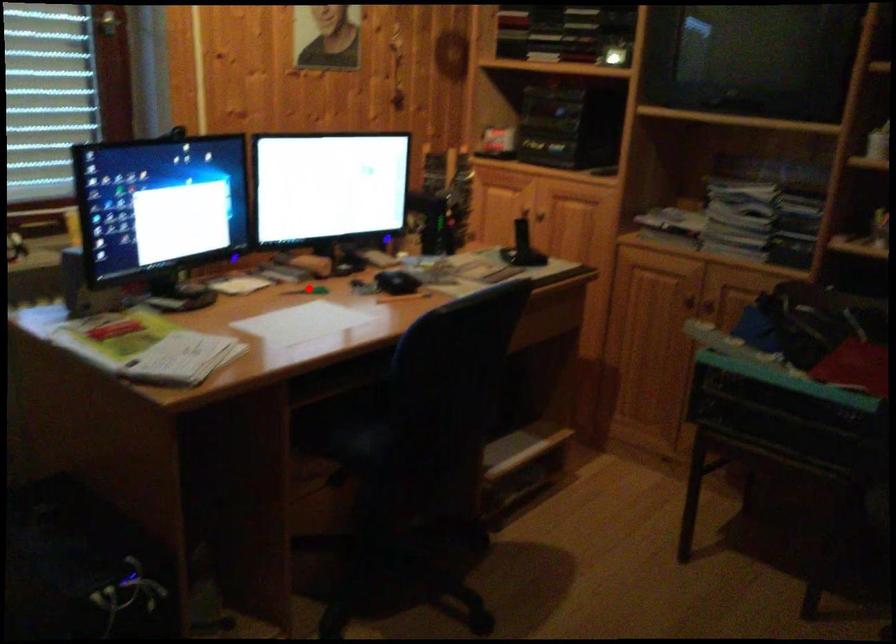
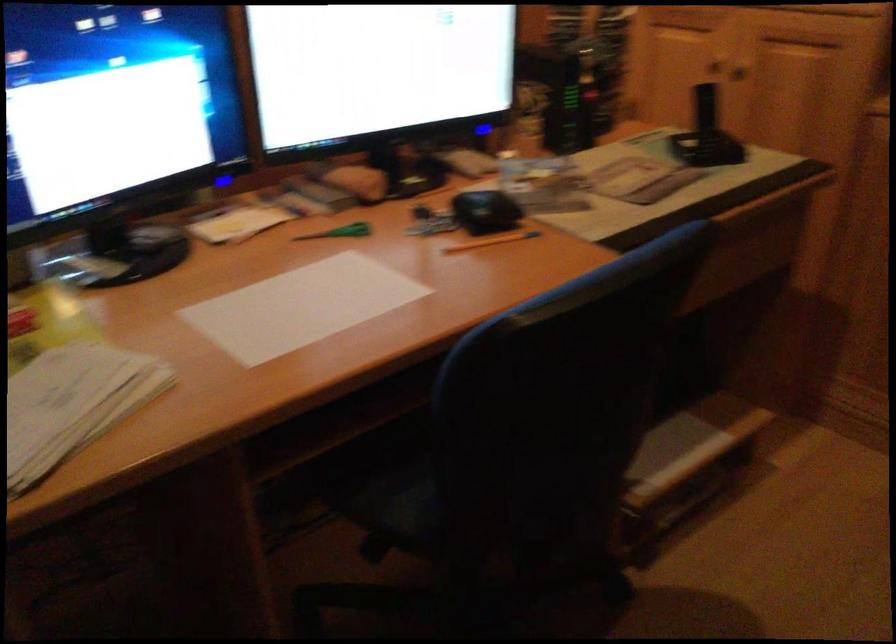
Question: I am providing you with two images of the same scene from different viewpoints. Image1 has a red point marked. In image2, the corresponding 3D location appears at what relative position? Reply with the corresponding letter.

Choices:
 (A) Closer
 (B) Farther

Answer: (A)